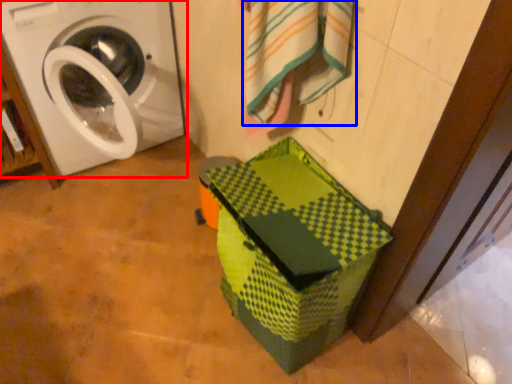
Question: Among these objects, which one is farthest to the camera, washing machine (highlighted by a red box) or bath towel (highlighted by a blue box)?

Choices:
 (A) washing machine
 (B) bath towel

Answer: (A)